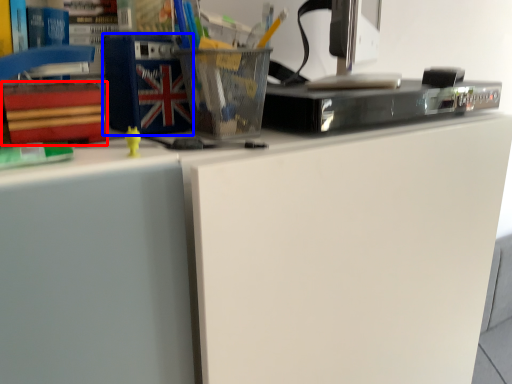
Question: Among these objects, which one is farthest to the camera, paperback book (highlighted by a red box) or paperback book (highlighted by a blue box)?

Choices:
 (A) paperback book
 (B) paperback book

Answer: (A)